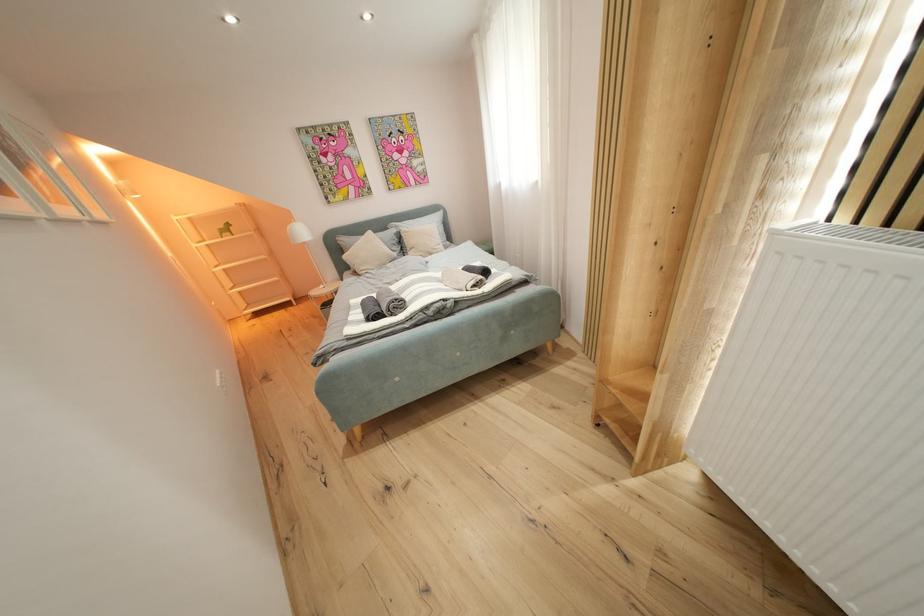
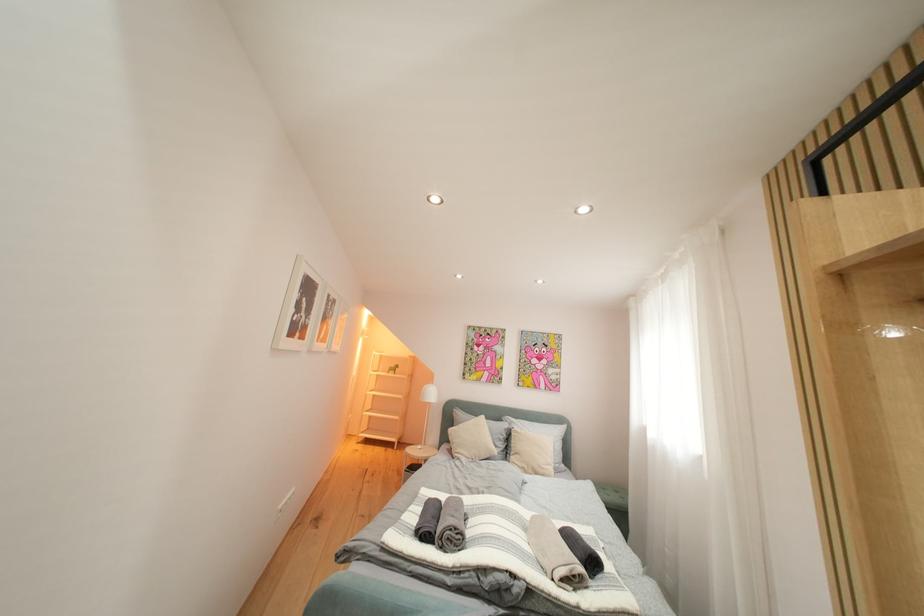
The first image is from the beginning of the video and the second image is from the end. How did the camera likely rotate when shooting the video?

The rotation direction of the camera is left-up.